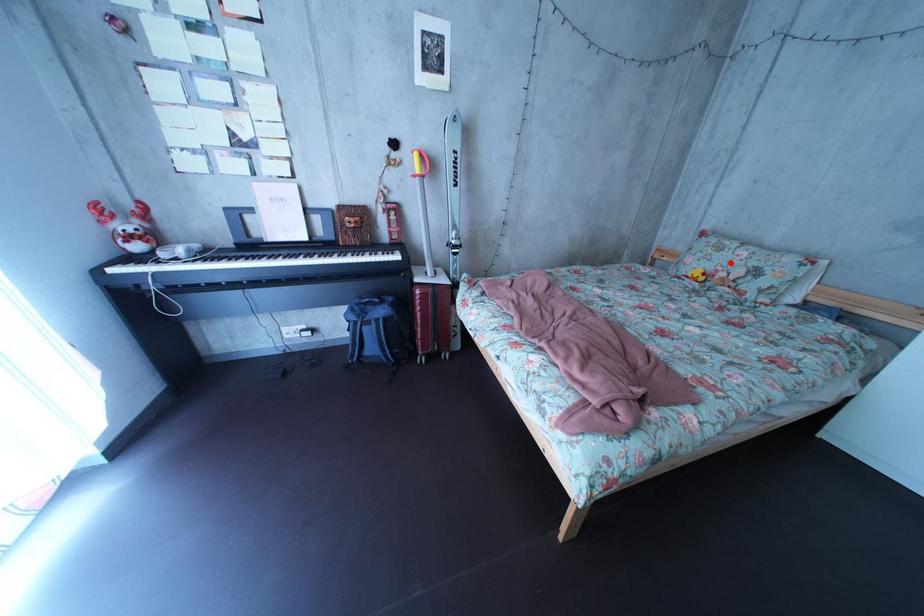
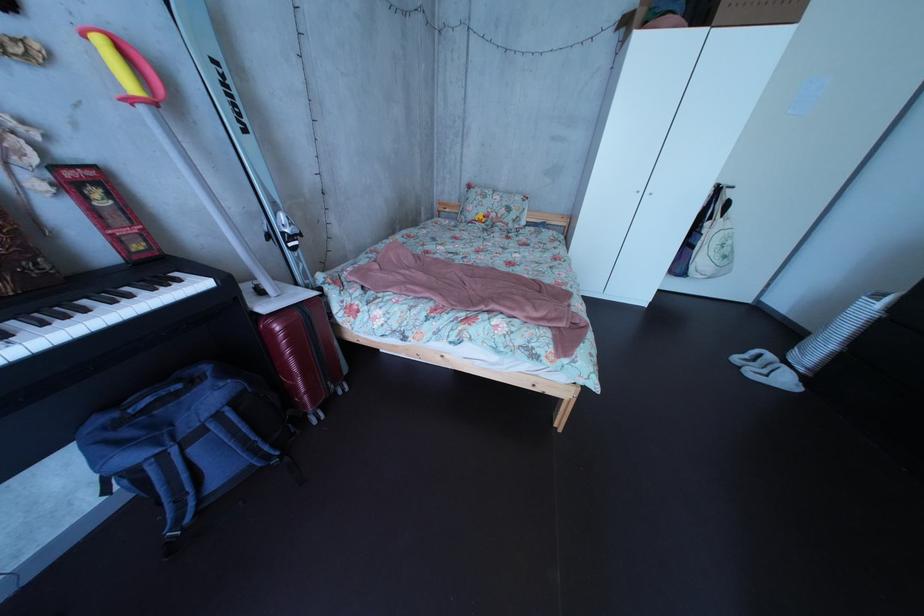
Question: I am providing you with two images of the same scene from different viewpoints. A red point is shown in image1. For the corresponding object point in image2, is it positioned nearer or farther from the camera?

Choices:
 (A) Nearer
 (B) Farther

Answer: (A)